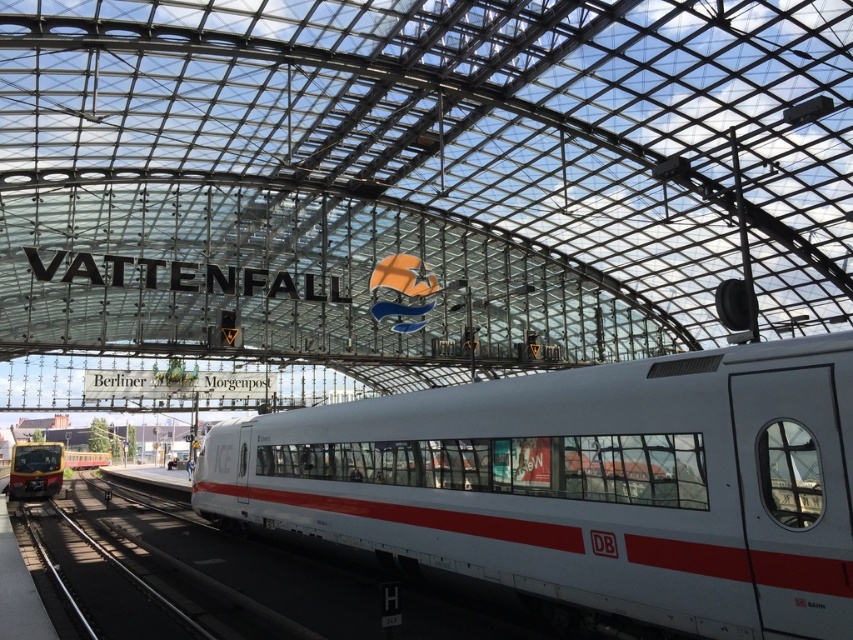
Question: Among these objects, which one is farthest from the camera?

Choices:
 (A) white glossy train at center
 (B) matte black train at lower left

Answer: (B)

Question: Does white glossy train at center have a larger size compared to matte black train at lower left?

Choices:
 (A) no
 (B) yes

Answer: (B)

Question: Can you confirm if white glossy train at center is smaller than matte black train at lower left?

Choices:
 (A) no
 (B) yes

Answer: (A)

Question: Is white glossy train at center positioned before matte black train at lower left?

Choices:
 (A) yes
 (B) no

Answer: (A)